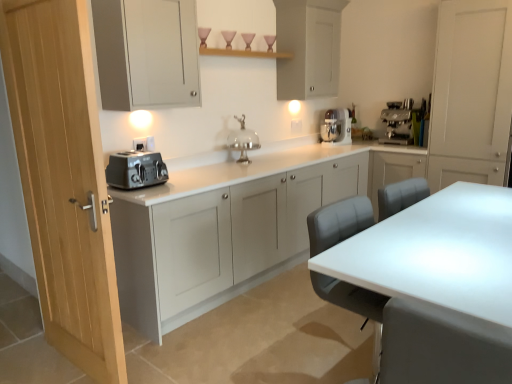
Question: Is white matte cabinet at right, arranged as the fourth cabinetry when viewed from the left, thinner than white glossy stand mixer at upper right?

Choices:
 (A) no
 (B) yes

Answer: (A)

Question: Is white glossy stand mixer at upper right at the back of white matte cabinet at right, marked as the 1th cabinetry in a right-to-left arrangement?

Choices:
 (A) no
 (B) yes

Answer: (A)

Question: Can white glossy stand mixer at upper right be found inside white matte cabinet at right, arranged as the fourth cabinetry when viewed from the left?

Choices:
 (A) no
 (B) yes

Answer: (A)

Question: Can you confirm if white matte cabinet at right, arranged as the fourth cabinetry when viewed from the left, is wider than white glossy stand mixer at upper right?

Choices:
 (A) no
 (B) yes

Answer: (B)

Question: From the image's perspective, would you say white matte cabinet at right, marked as the 1th cabinetry in a right-to-left arrangement, is shown under white glossy stand mixer at upper right?

Choices:
 (A) yes
 (B) no

Answer: (B)

Question: Can you confirm if white matte cabinet at right, marked as the 1th cabinetry in a right-to-left arrangement, is taller than white glossy stand mixer at upper right?

Choices:
 (A) yes
 (B) no

Answer: (A)

Question: From the image's perspective, is matte white electric outlet at upper center below white matte cabinet at right, arranged as the fourth cabinetry when viewed from the left?

Choices:
 (A) no
 (B) yes

Answer: (B)

Question: From a real-world perspective, is matte white electric outlet at upper center positioned over white matte cabinet at right, marked as the 1th cabinetry in a right-to-left arrangement, based on gravity?

Choices:
 (A) no
 (B) yes

Answer: (A)

Question: Is matte white electric outlet at upper center further to camera compared to white matte cabinet at right, arranged as the fourth cabinetry when viewed from the left?

Choices:
 (A) no
 (B) yes

Answer: (A)

Question: Does matte white electric outlet at upper center come in front of white matte cabinet at right, marked as the 1th cabinetry in a right-to-left arrangement?

Choices:
 (A) no
 (B) yes

Answer: (B)

Question: From the image's perspective, does matte white electric outlet at upper center appear higher than white matte cabinet at right, arranged as the fourth cabinetry when viewed from the left?

Choices:
 (A) no
 (B) yes

Answer: (A)

Question: Considering the relative sizes of matte white electric outlet at upper center and white matte cabinet at right, arranged as the fourth cabinetry when viewed from the left, in the image provided, is matte white electric outlet at upper center bigger than white matte cabinet at right, arranged as the fourth cabinetry when viewed from the left,?

Choices:
 (A) yes
 (B) no

Answer: (B)

Question: Would you say matte gray cabinet at left, which is the third cabinetry in right-to-left order, is part of matte gray cabinet at upper left, marked as the first cabinetry in a left-to-right arrangement,'s contents?

Choices:
 (A) yes
 (B) no

Answer: (B)